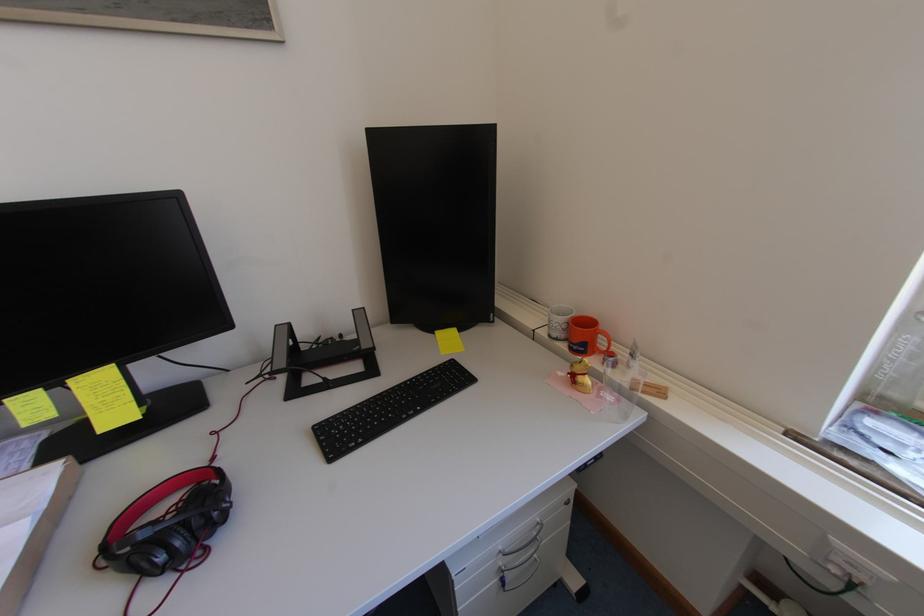
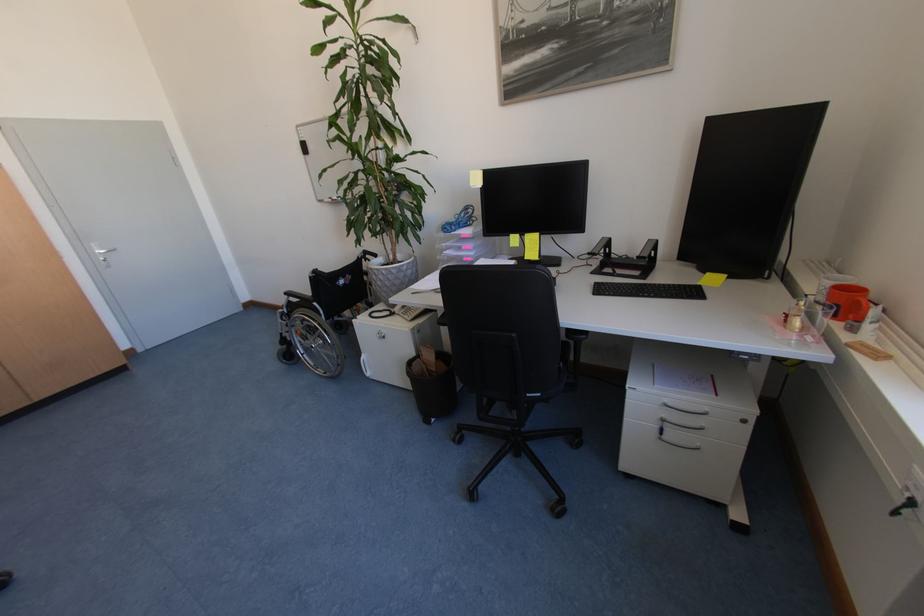
Locate, in the second image, the point that corresponds to pixel 562 336 in the first image.

(824, 300)